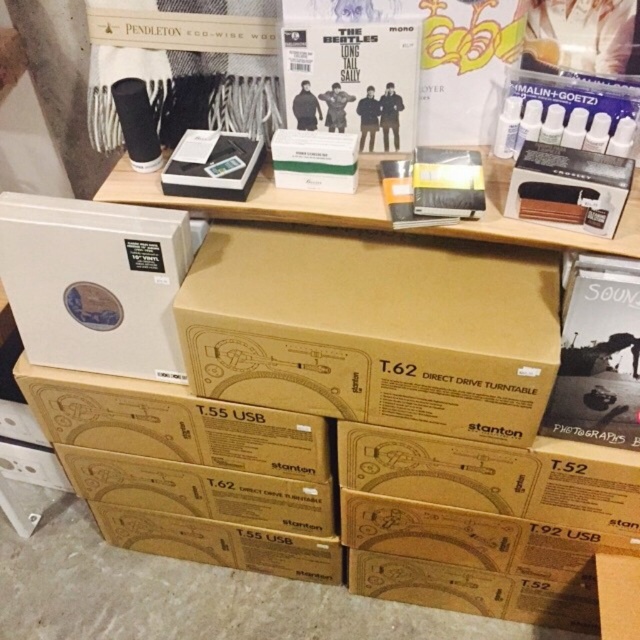
I want to click on brown cardboard box at center, so click(372, 330).

Is brown cardboard box at center in front of matte cardboard box at lower right?

No, it is behind matte cardboard box at lower right.

Is point (326, 396) more distant than point (620, 360)?

Yes, point (326, 396) is farther from viewer.

This screenshot has height=640, width=640. Find the location of `brown cardboard box at center`. brown cardboard box at center is located at coordinates (372, 330).

The image size is (640, 640). I want to click on white matte vinyl record at lower left, so click(x=96, y=282).

Can you confirm if white matte vinyl record at lower left is positioned to the right of matte cardboard box at lower right?

No, white matte vinyl record at lower left is not to the right of matte cardboard box at lower right.

Who is more distant from viewer, (x=19, y=240) or (x=566, y=348)?

The point (x=19, y=240) is more distant.

Locate an element on the screen. This screenshot has width=640, height=640. white matte vinyl record at lower left is located at coordinates (96, 282).

Which is more to the right, brown cardboard box at center or white matte vinyl record at lower left?

brown cardboard box at center is more to the right.

Who is taller, brown cardboard box at center or white matte vinyl record at lower left?

Standing taller between the two is brown cardboard box at center.

Describe the element at coordinates (372, 330) in the screenshot. I see `brown cardboard box at center` at that location.

Locate an element on the screen. brown cardboard box at center is located at coordinates (372, 330).